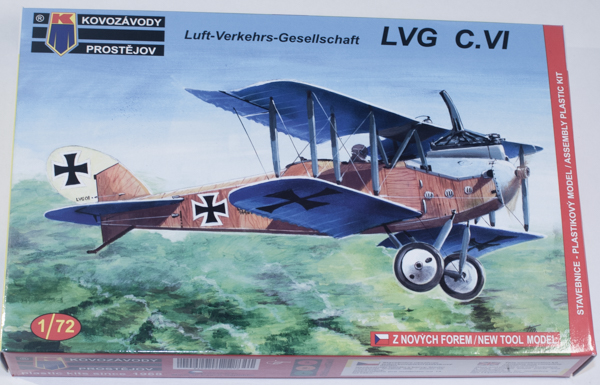
The image size is (600, 385). In order to click on table in this screenshot , I will do `click(591, 71)`.